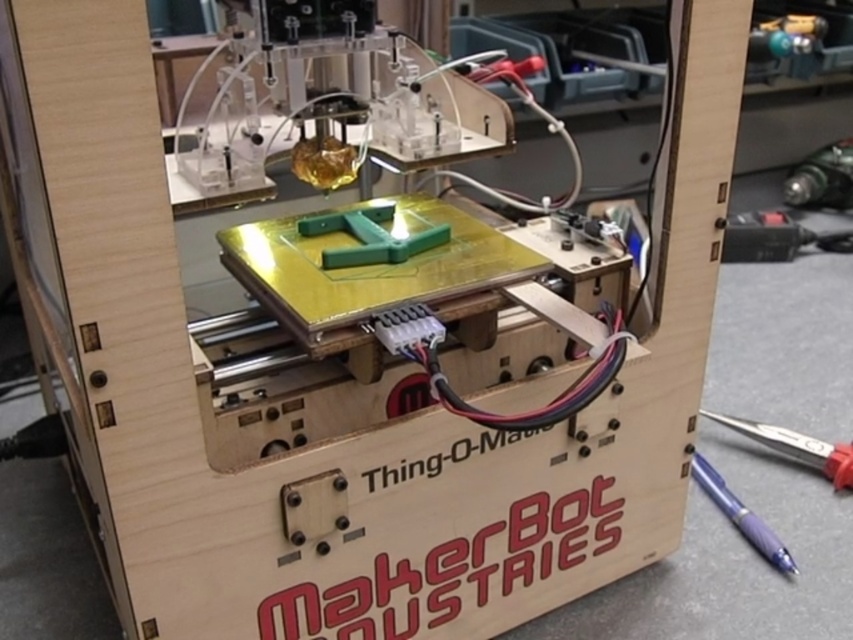
How much distance is there between green matte plastic at center and metallic blue pen at lower right?

The distance of green matte plastic at center from metallic blue pen at lower right is 25.75 inches.

Describe the element at coordinates (369, 236) in the screenshot. The image size is (853, 640). I see `green matte plastic at center` at that location.

Where is `green matte plastic at center`? The height and width of the screenshot is (640, 853). green matte plastic at center is located at coordinates (369, 236).

Where is `green matte plastic at center`? green matte plastic at center is located at coordinates (369, 236).

Who is more distant from viewer, [344,260] or [712,474]?

Point [712,474]

Between green matte plastic at center and purple glossy pen at lower right, which one has less height?

With less height is green matte plastic at center.

Find the location of a particular element. green matte plastic at center is located at coordinates (369, 236).

You are a GUI agent. You are given a task and a screenshot of the screen. Output one action in this format:
    pyautogui.click(x=<x>, y=<y>)
    Task: Click on the green matte plastic at center
    The height and width of the screenshot is (640, 853).
    Given the screenshot: What is the action you would take?
    pyautogui.click(x=369, y=236)

Between metallic blue pen at lower right and purple glossy pen at lower right, which one appears on the left side from the viewer's perspective?

From the viewer's perspective, purple glossy pen at lower right appears more on the left side.

Is metallic blue pen at lower right taller than purple glossy pen at lower right?

In fact, metallic blue pen at lower right may be shorter than purple glossy pen at lower right.

The height and width of the screenshot is (640, 853). What do you see at coordinates (796, 445) in the screenshot?
I see `metallic blue pen at lower right` at bounding box center [796, 445].

The width and height of the screenshot is (853, 640). Identify the location of metallic blue pen at lower right. (x=796, y=445).